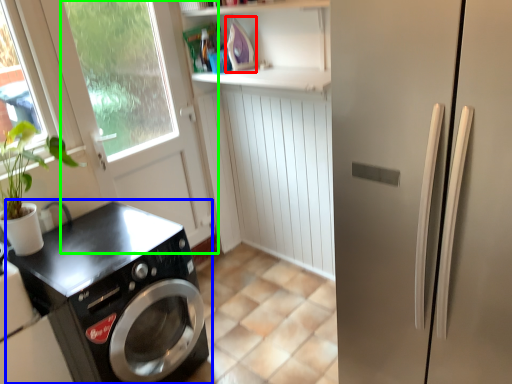
Question: Considering the real-world distances, which object is farthest from appliance (highlighted by a red box)? washing machine (highlighted by a blue box) or screen door (highlighted by a green box)?

Choices:
 (A) washing machine
 (B) screen door

Answer: (A)